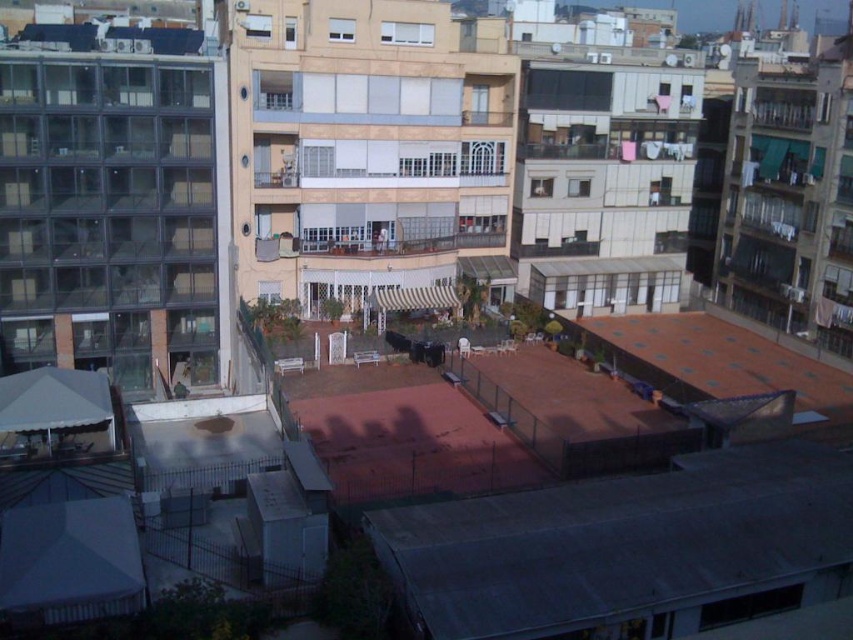
Question: Does gray metal roof at lower center have a smaller size compared to brown tiled roof at lower right?

Choices:
 (A) yes
 (B) no

Answer: (A)

Question: Does gray metal roof at lower center have a larger size compared to brown tiled roof at lower right?

Choices:
 (A) yes
 (B) no

Answer: (B)

Question: Which point appears farthest from the camera in this image?

Choices:
 (A) (757, 612)
 (B) (679, 380)

Answer: (B)

Question: Which of the following is the closest to the observer?

Choices:
 (A) (746, 360)
 (B) (424, 531)

Answer: (B)

Question: Is gray metal roof at lower center in front of brown tiled roof at lower right?

Choices:
 (A) yes
 (B) no

Answer: (A)